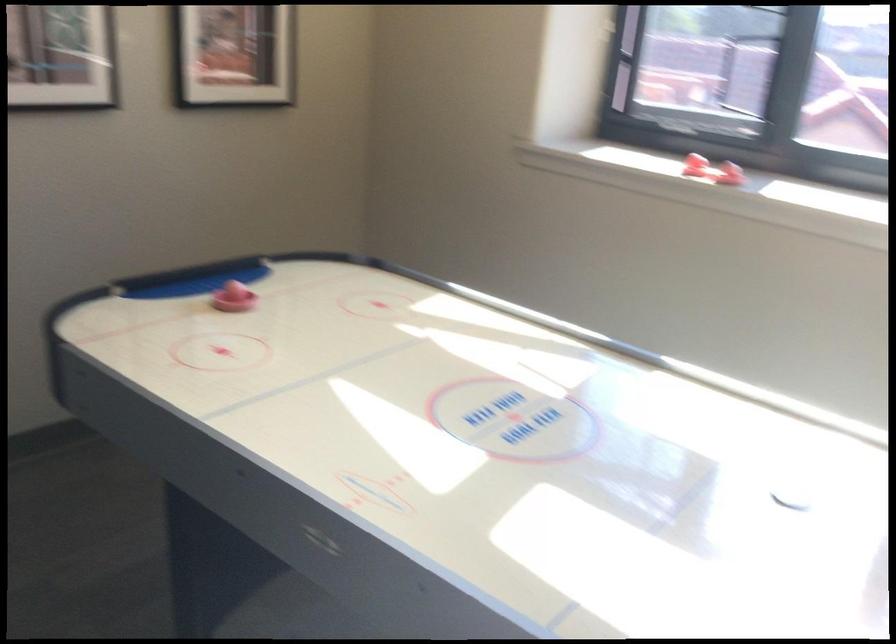
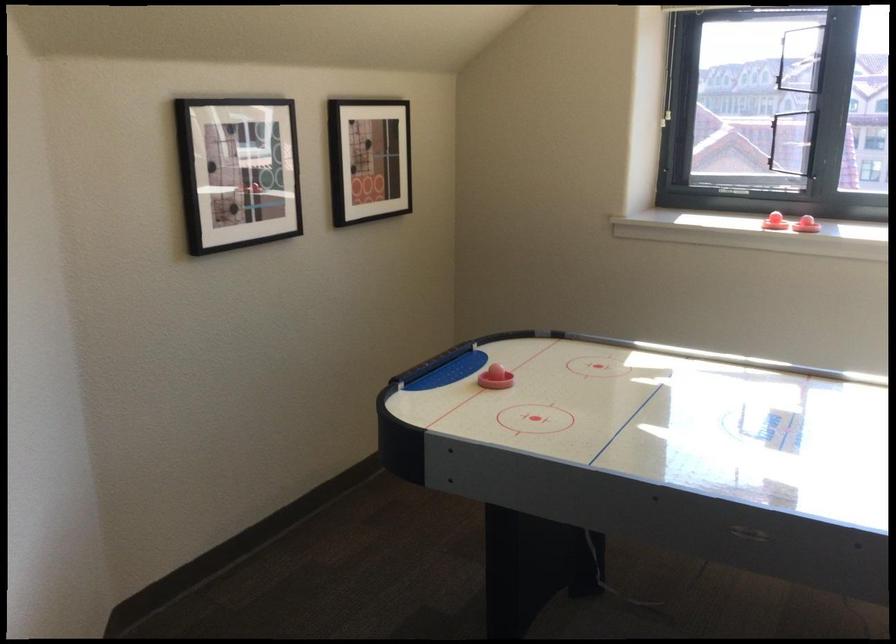
Find the pixel in the second image that matches [233,305] in the first image.

(495, 379)